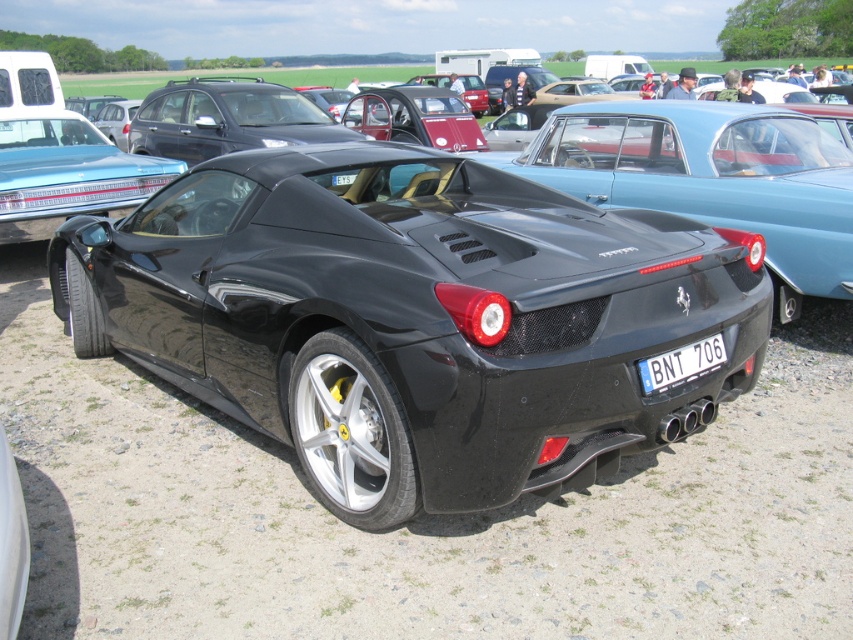
Question: Which of the following is the farthest from the observer?

Choices:
 (A) shiny black sports car at center
 (B) white plastic license plate at center

Answer: (B)

Question: Which of the following is the farthest from the observer?

Choices:
 (A) shiny black sports car at center
 (B) white plastic license plate at center

Answer: (B)

Question: Is shiny black sports car at center behind white plastic license plate at center?

Choices:
 (A) no
 (B) yes

Answer: (A)

Question: Is shiny black sports car at center to the right of white plastic license plate at center from the viewer's perspective?

Choices:
 (A) yes
 (B) no

Answer: (B)

Question: Which point is farther from the camera taking this photo?

Choices:
 (A) pyautogui.click(x=650, y=378)
 (B) pyautogui.click(x=529, y=413)

Answer: (A)

Question: Is shiny black sports car at center bigger than white plastic license plate at center?

Choices:
 (A) no
 (B) yes

Answer: (B)